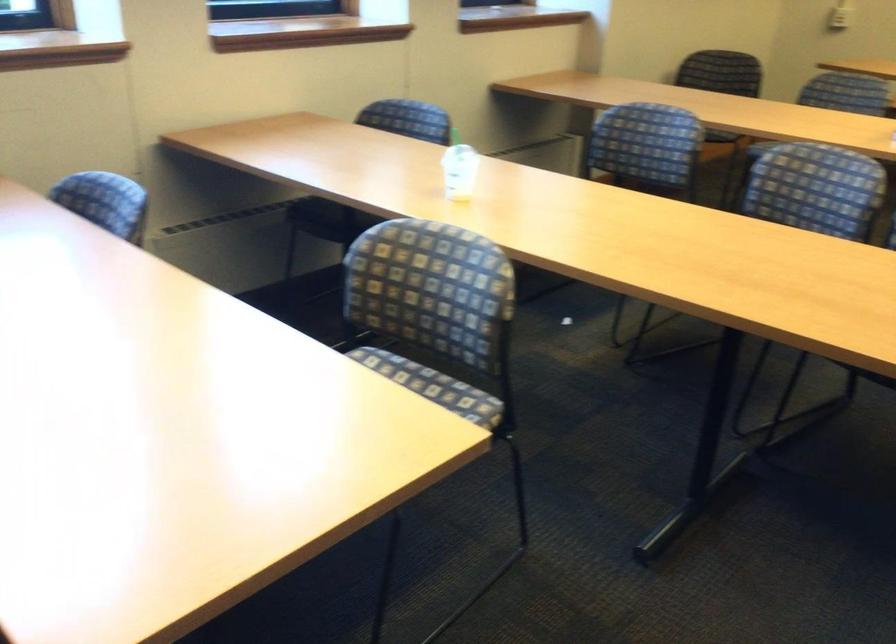
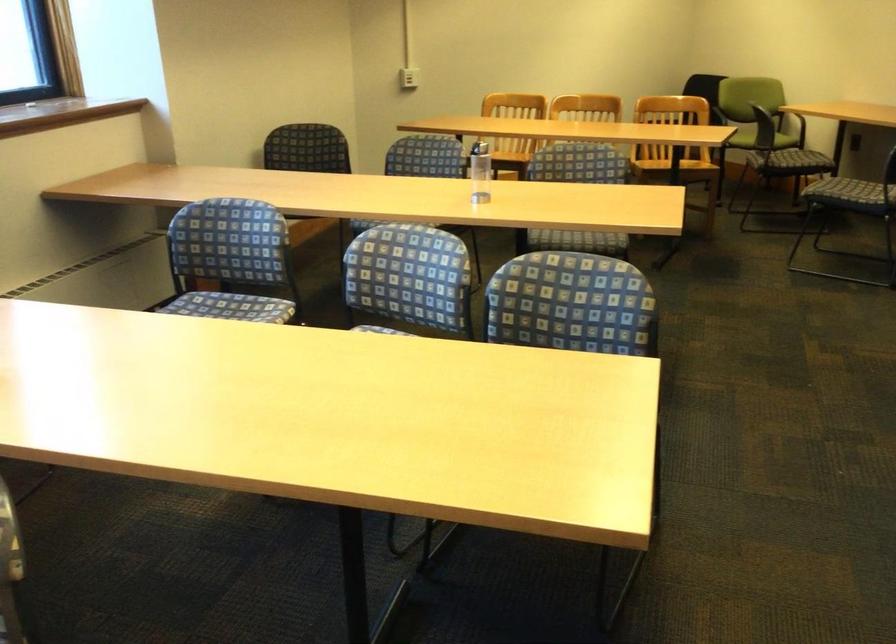
In the scene shown: The images are taken continuously from a first-person perspective. In which direction are you moving?

The cameraman moved toward right, forward.